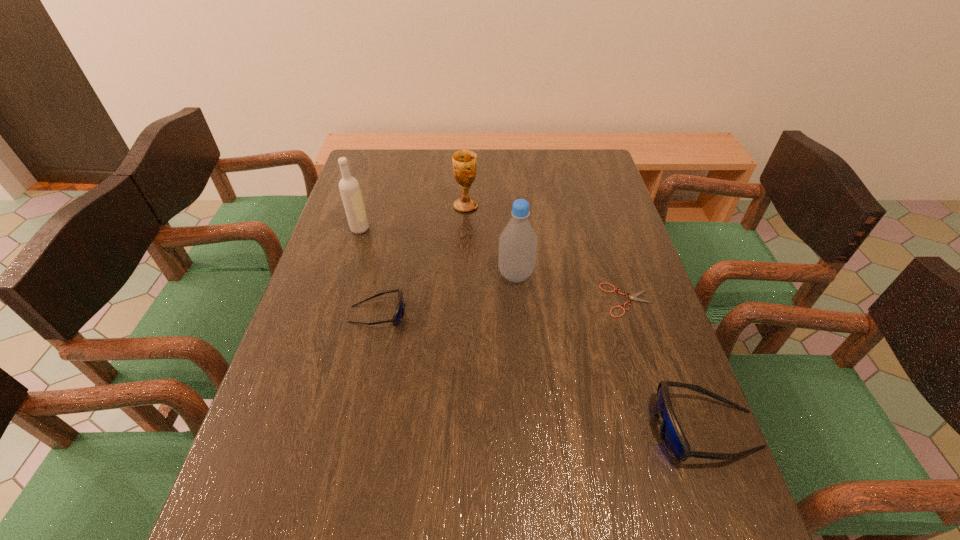
The width and height of the screenshot is (960, 540). Identify the location of free point located on the front-facing side of the second shortest object. (454, 314).

The image size is (960, 540). I want to click on vacant region located 0.370m on the front-facing side of the nearer sunglasses, so click(x=468, y=429).

Image resolution: width=960 pixels, height=540 pixels. Find the location of `vacant area situated 0.290m on the front-facing side of the nearer sunglasses`. vacant area situated 0.290m on the front-facing side of the nearer sunglasses is located at coordinates (509, 429).

The height and width of the screenshot is (540, 960). In order to click on free space located on the front-facing side of the nearer sunglasses in this screenshot , I will do `click(514, 429)`.

The height and width of the screenshot is (540, 960). I want to click on vacant point located on the right of the farthest object, so 524,206.

At what (x,y) coordinates should I click in order to perform the action: click on vacant space located on the front of the shortest object. Please return your answer as a coordinate pair (x, y). This screenshot has height=540, width=960. Looking at the image, I should click on (665, 420).

In order to click on blank space located on the back of the fifth nearest object in this screenshot , I will do `click(379, 165)`.

You are a GUI agent. You are given a task and a screenshot of the screen. Output one action in this format:
    pyautogui.click(x=<x>, y=<y>)
    Task: Click on the free location located 0.360m on the left of the fourth object from left to right
    
    Given the screenshot: What is the action you would take?
    pyautogui.click(x=365, y=275)

Locate an element on the screen. object that is positioned at the near edge is located at coordinates (672, 436).

Identify the location of sunglasses positioned at the left edge. Image resolution: width=960 pixels, height=540 pixels. (399, 312).